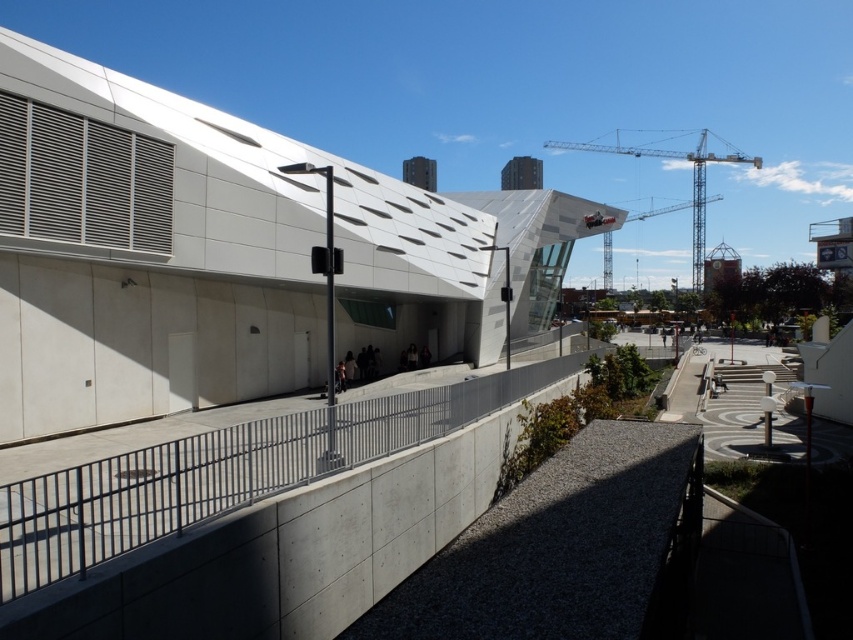
Does gray metallic rail at center have a lesser width compared to metallic gray crane at upper right?

Yes.

Is point (306, 465) less distant than point (648, 148)?

Yes.

The width and height of the screenshot is (853, 640). In order to click on gray metallic rail at center in this screenshot , I will do `click(146, 496)`.